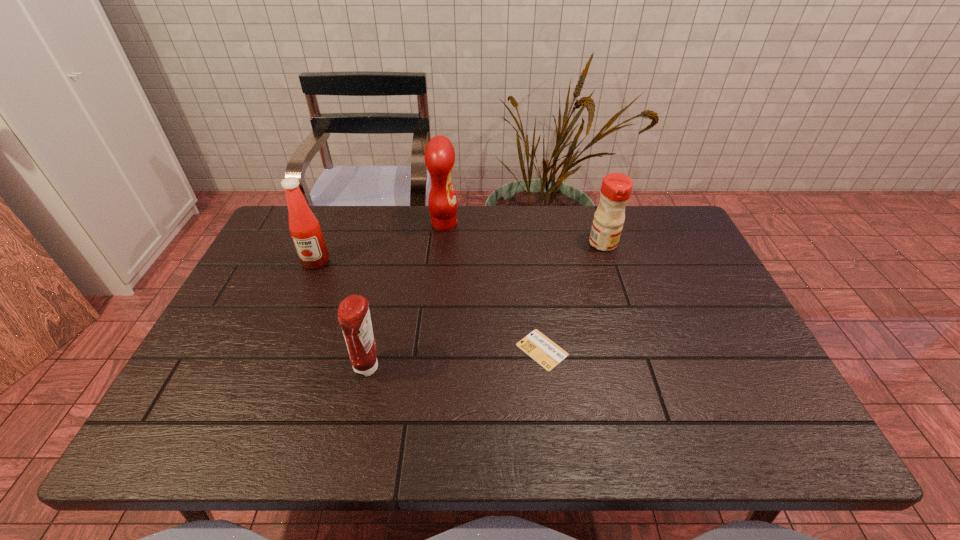
Locate an element on the screen. the third object from right to left is located at coordinates (439, 155).

At what (x,y) coordinates should I click in order to perform the action: click on the third farthest condiment. Please return your answer as a coordinate pair (x, y). Image resolution: width=960 pixels, height=540 pixels. Looking at the image, I should click on [x=305, y=230].

Locate an element on the screen. the leftmost object is located at coordinates (305, 230).

Image resolution: width=960 pixels, height=540 pixels. In order to click on the rightmost condiment in this screenshot , I will do `click(616, 188)`.

This screenshot has height=540, width=960. I want to click on the second object from left to right, so click(353, 313).

The width and height of the screenshot is (960, 540). Identify the location of the second condiment from left to right. (353, 313).

The height and width of the screenshot is (540, 960). Identify the location of the shortest object. (545, 352).

Locate an element on the screen. The width and height of the screenshot is (960, 540). the second object from right to left is located at coordinates (545, 352).

Locate an element on the screen. vacant region located on the label side of the second condiment from right to left is located at coordinates (495, 224).

Identify the location of free spot located on the front-facing side of the third farthest object. The image size is (960, 540). (297, 309).